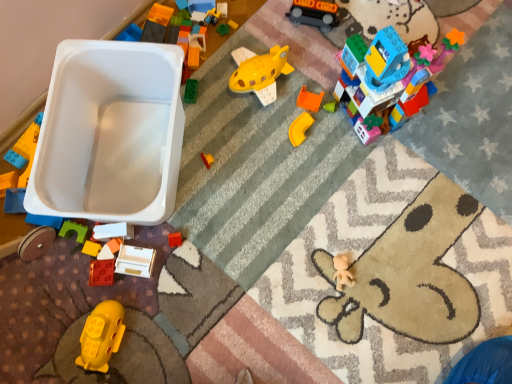
The height and width of the screenshot is (384, 512). I want to click on vacant space that is in between rubberized orange block at lower left, the 1th toy positioned from the left, and multicolored plastic building block at upper right, the first toy when ordered from right to left, so [268, 158].